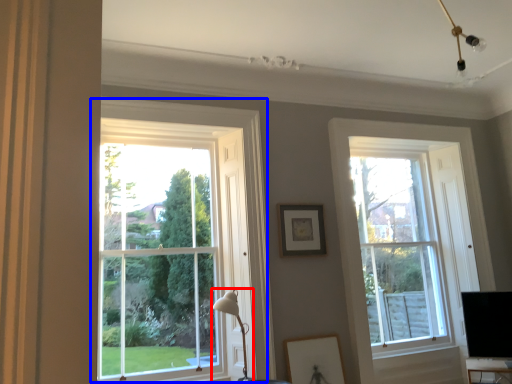
Question: Which point is further to the camera, table lamp (highlighted by a red box) or window (highlighted by a blue box)?

Choices:
 (A) table lamp
 (B) window

Answer: (B)